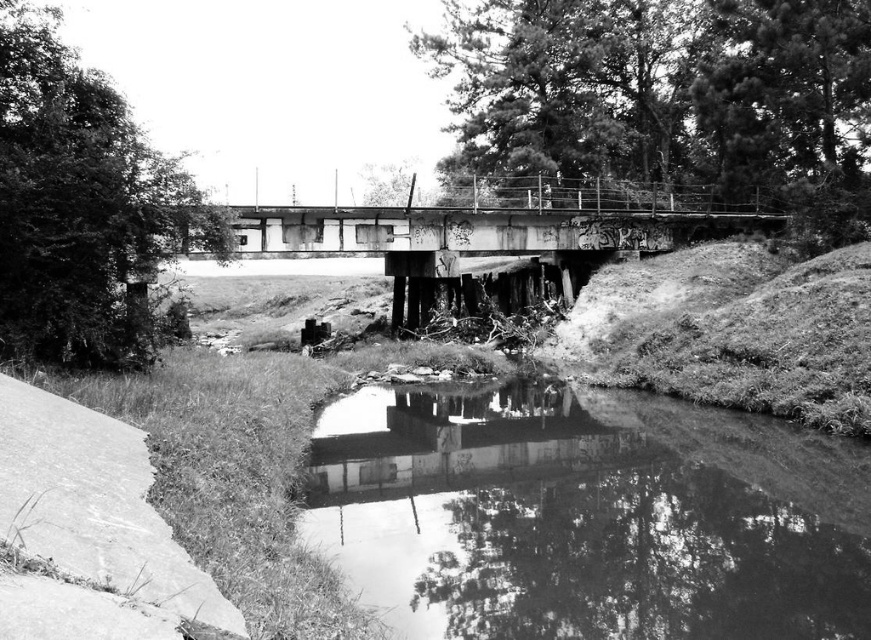
What do you see at coordinates (579, 520) in the screenshot? The width and height of the screenshot is (871, 640). I see `smooth concrete water at lower center` at bounding box center [579, 520].

Where is `smooth concrete water at lower center`? The image size is (871, 640). smooth concrete water at lower center is located at coordinates (579, 520).

Does point (714, 528) come farther from viewer compared to point (713, 225)?

That is False.

At what (x,y) coordinates should I click in order to perform the action: click on smooth concrete water at lower center. Please return your answer as a coordinate pair (x, y). The image size is (871, 640). Looking at the image, I should click on (579, 520).